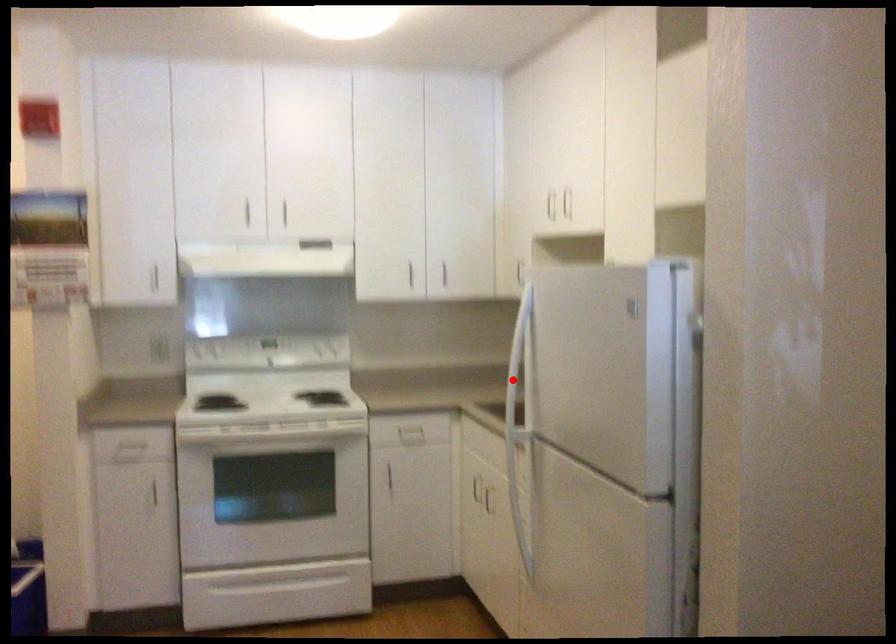
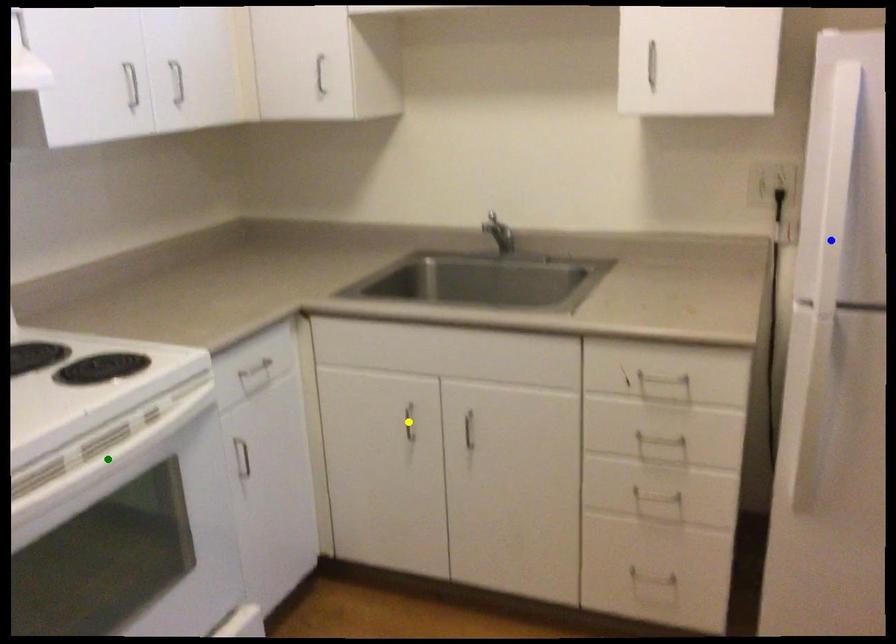
Question: I am providing you with two images of the same scene from different viewpoints. A red point is marked on the first image. You are given multiple points on the second image. Which point in image 2 is actually the same real-world point as the red point in image 1?

Choices:
 (A) yellow point
 (B) green point
 (C) blue point

Answer: (C)